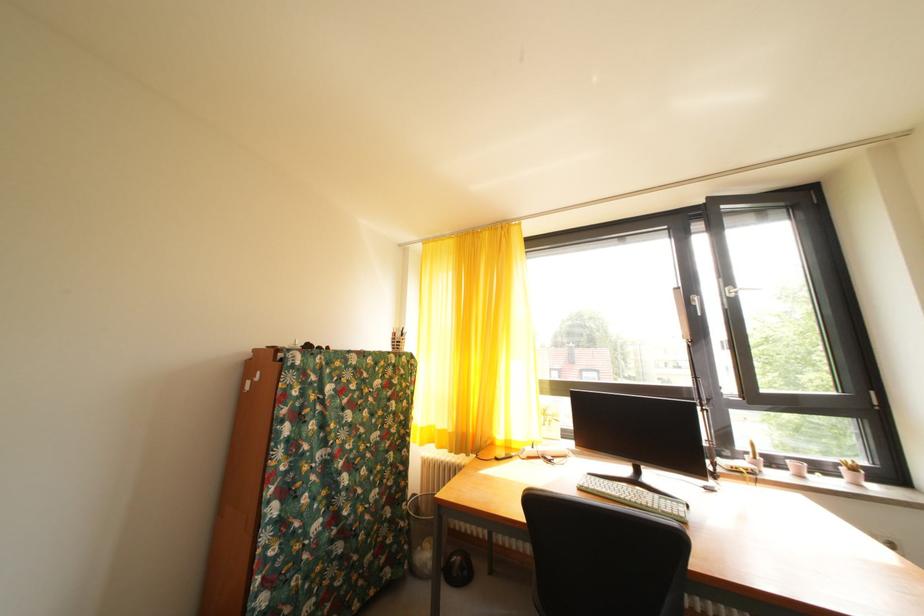
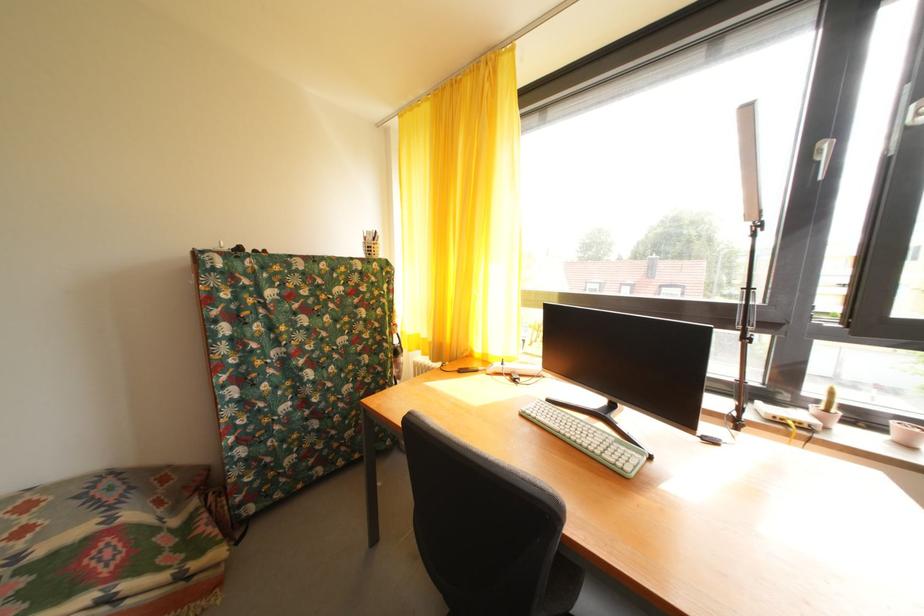
Locate, in the second image, the point that corresponds to point 448,438 in the first image.

(432, 346)